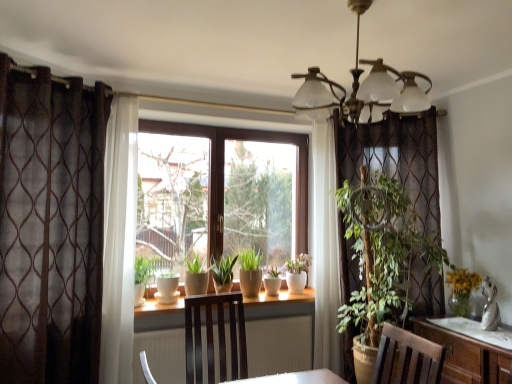
Question: Does white ceramic flowerpot at center, which ranks as the 2th flowerpot in left-to-right order, have a greater height compared to brown sheer curtain at left?

Choices:
 (A) yes
 (B) no

Answer: (B)

Question: Is white ceramic flowerpot at center, which ranks as the 2th flowerpot in left-to-right order, shorter than brown sheer curtain at left?

Choices:
 (A) no
 (B) yes

Answer: (B)

Question: Would you say white ceramic flowerpot at center, which ranks as the 2th flowerpot in left-to-right order, is outside brown sheer curtain at left?

Choices:
 (A) no
 (B) yes

Answer: (B)

Question: From the image's perspective, is white ceramic flowerpot at center, which ranks as the 2th flowerpot in left-to-right order, located above brown sheer curtain at left?

Choices:
 (A) no
 (B) yes

Answer: (A)

Question: Is white ceramic flowerpot at center, which ranks as the 2th flowerpot in left-to-right order, touching brown sheer curtain at left?

Choices:
 (A) no
 (B) yes

Answer: (A)

Question: Is point (366, 91) closer or farther from the camera than point (287, 268)?

Choices:
 (A) farther
 (B) closer

Answer: (B)

Question: Considering the positions of metallic brass chandelier at upper center and white ceramic pot at center in the image, is metallic brass chandelier at upper center taller or shorter than white ceramic pot at center?

Choices:
 (A) short
 (B) tall

Answer: (B)

Question: From a real-world perspective, is metallic brass chandelier at upper center positioned above or below white ceramic pot at center?

Choices:
 (A) below
 (B) above

Answer: (B)

Question: From the image's perspective, is metallic brass chandelier at upper center positioned above or below white ceramic pot at center?

Choices:
 (A) above
 (B) below

Answer: (A)

Question: From a real-world perspective, is white ceramic flowerpot at center, the 1th flowerpot in the right-to-left sequence, physically located above or below matte ceramic pot at center, positioned as the second flowerpot in right-to-left order?

Choices:
 (A) above
 (B) below

Answer: (A)

Question: Is white ceramic flowerpot at center, the 1th flowerpot in the right-to-left sequence, in front of or behind matte ceramic pot at center, which is counted as the first flowerpot, starting from the left, in the image?

Choices:
 (A) behind
 (B) front

Answer: (A)

Question: Considering the positions of white ceramic flowerpot at center, which ranks as the 2th flowerpot in left-to-right order, and matte ceramic pot at center, which is counted as the first flowerpot, starting from the left, in the image, is white ceramic flowerpot at center, which ranks as the 2th flowerpot in left-to-right order, wider or thinner than matte ceramic pot at center, which is counted as the first flowerpot, starting from the left,?

Choices:
 (A) thin
 (B) wide

Answer: (A)

Question: Is point (279, 286) positioned closer to the camera than point (254, 276)?

Choices:
 (A) closer
 (B) farther

Answer: (B)

Question: Relative to white ceramic pot at center, is matte ceramic pot at center, positioned as the second flowerpot in right-to-left order, in front or behind?

Choices:
 (A) front
 (B) behind

Answer: (A)

Question: Based on their sizes in the image, would you say matte ceramic pot at center, positioned as the second flowerpot in right-to-left order, is bigger or smaller than white ceramic pot at center?

Choices:
 (A) small
 (B) big

Answer: (A)